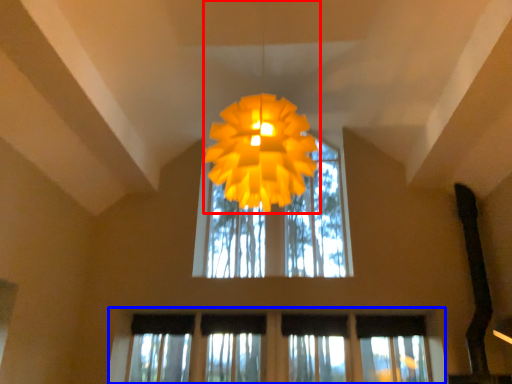
Question: Which of the following is the farthest to the observer, lamp (highlighted by a red box) or window (highlighted by a blue box)?

Choices:
 (A) lamp
 (B) window

Answer: (B)